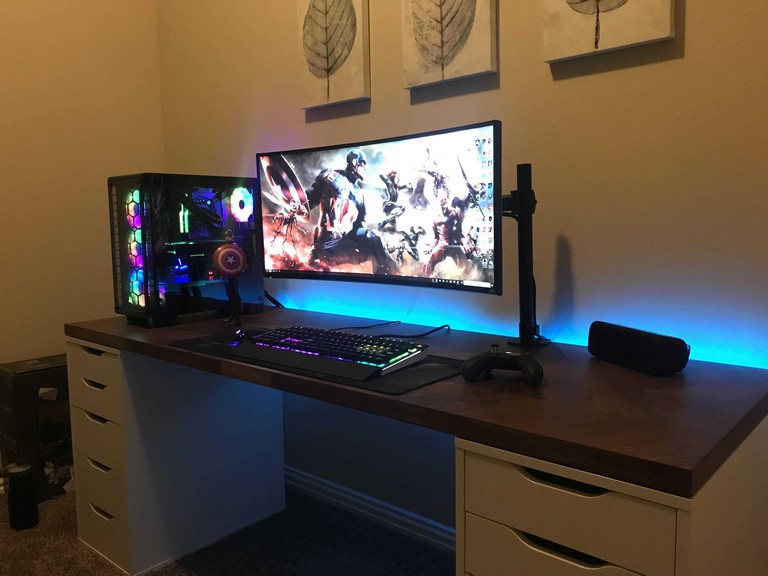
Locate an element on the screen. blue lighted area in back of the desk on the far right is located at coordinates (727, 346).